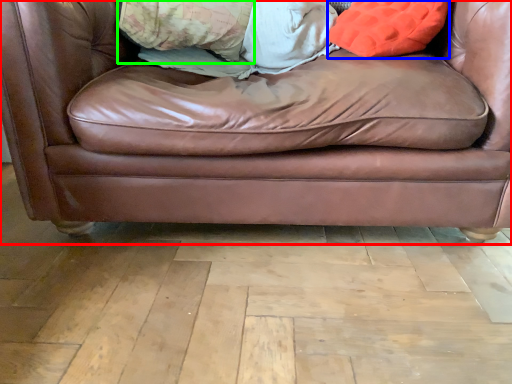
Question: Which is farther away from studio couch (highlighted by a red box)? throw pillow (highlighted by a blue box) or pillow (highlighted by a green box)?

Choices:
 (A) throw pillow
 (B) pillow

Answer: (B)